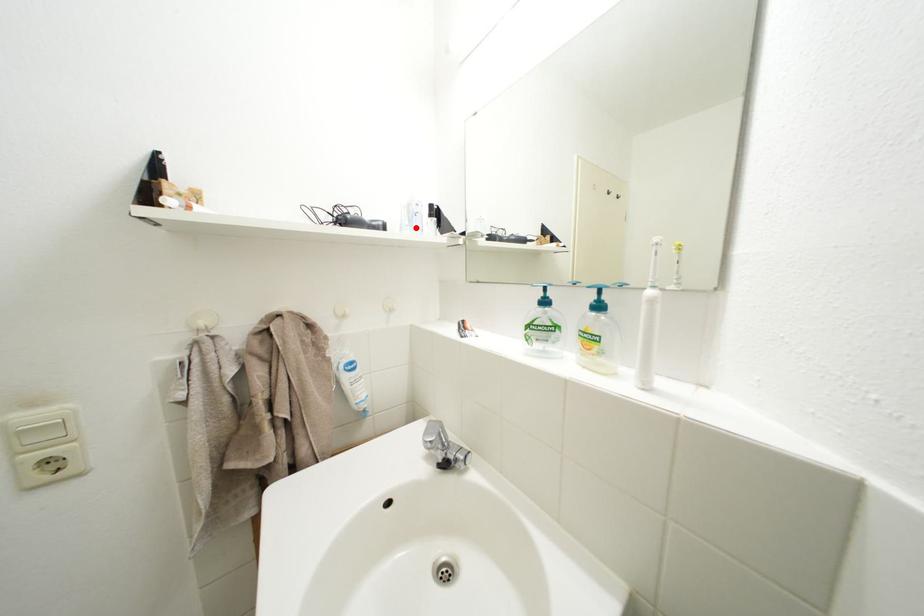
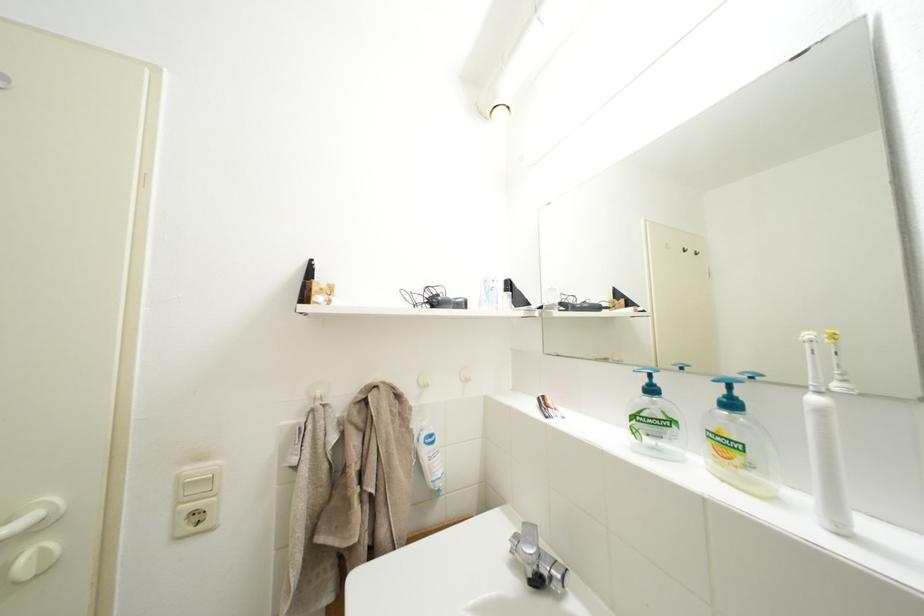
Where in the second image is the point corresponding to the highlighted location from the first image?

(493, 302)